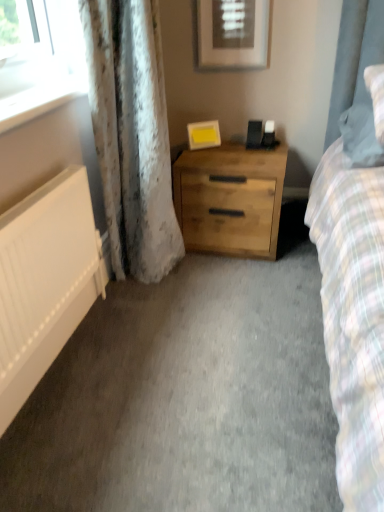
The image size is (384, 512). What do you see at coordinates (230, 199) in the screenshot?
I see `natural wood chest of drawers at center` at bounding box center [230, 199].

At what (x,y) coordinates should I click in order to perform the action: click on white matte radiator at left. Please return your answer as a coordinate pair (x, y). The width and height of the screenshot is (384, 512). Looking at the image, I should click on (45, 281).

At what (x,y) coordinates should I click in order to perform the action: click on fluffy white pillow at right. Please return your answer as a coordinate pair (x, y). This screenshot has width=384, height=512. Looking at the image, I should click on (366, 123).

How much space does matte white picture frame at upper center, the 2th picture frame positioned from the bottom, occupy horizontally?

matte white picture frame at upper center, the 2th picture frame positioned from the bottom, is 1.44 inches in width.

Find the location of a particular element. Image resolution: width=384 pixels, height=512 pixels. yellow matte picture frame at center, which is counted as the 2th picture frame, starting from the top is located at coordinates (203, 134).

At what (x,y) coordinates should I click in order to perform the action: click on white textured curtain at left. Please return your answer as a coordinate pair (x, y). Looking at the image, I should click on click(132, 135).

The width and height of the screenshot is (384, 512). In order to click on natural wood chest of drawers at center in this screenshot , I will do `click(230, 199)`.

Which object is more forward, fluffy white pillow at right or matte white picture frame at upper center, which appears as the 1th picture frame when viewed from the top?

fluffy white pillow at right is in front.

Starting from the fluffy white pillow at right, which picture frame is the 1st one to the left? Please provide its 2D coordinates.

[(233, 34)]

Where is `chest of drawers that appears on the right of matte white picture frame at upper center, the 2th picture frame positioned from the bottom`? chest of drawers that appears on the right of matte white picture frame at upper center, the 2th picture frame positioned from the bottom is located at coordinates (230, 199).

Does point (240, 168) come in front of point (248, 46)?

Yes, point (240, 168) is closer to viewer.

Is natural wood chest of drawers at center bigger or smaller than matte white picture frame at upper center, the 2th picture frame positioned from the bottom?

Considering their sizes, natural wood chest of drawers at center takes up more space than matte white picture frame at upper center, the 2th picture frame positioned from the bottom.

From the image's perspective, which one is positioned higher, natural wood chest of drawers at center or matte white picture frame at upper center, which appears as the 1th picture frame when viewed from the top?

From the image's view, matte white picture frame at upper center, which appears as the 1th picture frame when viewed from the top, is above.

From the image's perspective, which one is positioned higher, white matte radiator at left or white glossy window sill at upper left?

white glossy window sill at upper left, from the image's perspective.

From the picture: From a real-world perspective, which object rests below the other?

white matte radiator at left is physically lower.

Is white matte radiator at left oriented away from white glossy window sill at upper left?

No, white glossy window sill at upper left is not at the back of white matte radiator at left.

Between yellow matte picture frame at center, which is counted as the 2th picture frame, starting from the top, and matte white picture frame at upper center, the 2th picture frame positioned from the bottom, which one has larger size?

With larger size is matte white picture frame at upper center, the 2th picture frame positioned from the bottom.

From the image's perspective, between yellow matte picture frame at center, which is counted as the 2th picture frame, starting from the top, and matte white picture frame at upper center, the 2th picture frame positioned from the bottom, who is located below?

yellow matte picture frame at center, which is counted as the 2th picture frame, starting from the top, appears lower in the image.

In the image, is yellow matte picture frame at center, which is the 1th picture frame in bottom-to-top order, on the left side or the right side of matte white picture frame at upper center, the 2th picture frame positioned from the bottom?

Clearly, yellow matte picture frame at center, which is the 1th picture frame in bottom-to-top order, is on the left of matte white picture frame at upper center, the 2th picture frame positioned from the bottom, in the image.

Does yellow matte picture frame at center, which is the 1th picture frame in bottom-to-top order, have a lesser height compared to matte white picture frame at upper center, which appears as the 1th picture frame when viewed from the top?

Yes.

Is white textured curtain at left next to yellow matte picture frame at center, which is the 1th picture frame in bottom-to-top order, and touching it?

No, white textured curtain at left is not next to yellow matte picture frame at center, which is the 1th picture frame in bottom-to-top order.

Is white textured curtain at left outside of yellow matte picture frame at center, which is counted as the 2th picture frame, starting from the top?

white textured curtain at left lies outside yellow matte picture frame at center, which is counted as the 2th picture frame, starting from the top,'s area.

Which is behind, white textured curtain at left or yellow matte picture frame at center, which is the 1th picture frame in bottom-to-top order?

yellow matte picture frame at center, which is the 1th picture frame in bottom-to-top order, is further away from the camera.

Locate an element on the screen. The image size is (384, 512). the chest of drawers that appears below the fluffy white pillow at right (from the image's perspective) is located at coordinates (230, 199).

Consider the image. Does fluffy white pillow at right touch natural wood chest of drawers at center?

No, fluffy white pillow at right is not next to natural wood chest of drawers at center.

Considering the positions of objects matte white picture frame at upper center, which appears as the 1th picture frame when viewed from the top, and yellow matte picture frame at center, which is counted as the 2th picture frame, starting from the top, in the image provided, who is more to the left, matte white picture frame at upper center, which appears as the 1th picture frame when viewed from the top, or yellow matte picture frame at center, which is counted as the 2th picture frame, starting from the top,?

yellow matte picture frame at center, which is counted as the 2th picture frame, starting from the top.

The image size is (384, 512). Find the location of `picture frame above the yellow matte picture frame at center, which is counted as the 2th picture frame, starting from the top (from a real-world perspective)`. picture frame above the yellow matte picture frame at center, which is counted as the 2th picture frame, starting from the top (from a real-world perspective) is located at coordinates (233, 34).

Does matte white picture frame at upper center, which appears as the 1th picture frame when viewed from the top, turn towards yellow matte picture frame at center, which is counted as the 2th picture frame, starting from the top?

No, matte white picture frame at upper center, which appears as the 1th picture frame when viewed from the top, is not facing towards yellow matte picture frame at center, which is counted as the 2th picture frame, starting from the top.

Is matte white picture frame at upper center, which appears as the 1th picture frame when viewed from the top, smaller than yellow matte picture frame at center, which is the 1th picture frame in bottom-to-top order?

No, matte white picture frame at upper center, which appears as the 1th picture frame when viewed from the top, is not smaller than yellow matte picture frame at center, which is the 1th picture frame in bottom-to-top order.

Where is `pillow below the matte white picture frame at upper center, which appears as the 1th picture frame when viewed from the top (from the image's perspective)`? This screenshot has width=384, height=512. pillow below the matte white picture frame at upper center, which appears as the 1th picture frame when viewed from the top (from the image's perspective) is located at coordinates (366, 123).

Starting from the natural wood chest of drawers at center, which picture frame is the 1st one to the left? Please provide its 2D coordinates.

[(233, 34)]

Looking at the image, which one is located closer to yellow matte picture frame at center, which is counted as the 2th picture frame, starting from the top, white matte radiator at left or fluffy white pillow at right?

fluffy white pillow at right.

Estimate the real-world distances between objects in this image. Which object is closer to fluffy white pillow at right, matte white picture frame at upper center, the 2th picture frame positioned from the bottom, or white textured curtain at left?

matte white picture frame at upper center, the 2th picture frame positioned from the bottom, lies closer to fluffy white pillow at right than the other object.

Considering their positions, is white glossy window sill at upper left positioned further to fluffy white pillow at right than natural wood chest of drawers at center?

white glossy window sill at upper left.

When comparing their distances from natural wood chest of drawers at center, does fluffy white pillow at right or white textured curtain at left seem further?

The object further to natural wood chest of drawers at center is fluffy white pillow at right.

Based on the photo, which object lies nearer to the anchor point fluffy white pillow at right, white matte radiator at left or white glossy window sill at upper left?

white glossy window sill at upper left is closer to fluffy white pillow at right.

Estimate the real-world distances between objects in this image. Which object is closer to white textured curtain at left, white glossy window sill at upper left or fluffy white pillow at right?

white glossy window sill at upper left is positioned closer to the anchor white textured curtain at left.

Considering their positions, is natural wood chest of drawers at center positioned closer to white glossy window sill at upper left than yellow matte picture frame at center, which is counted as the 2th picture frame, starting from the top?

natural wood chest of drawers at center is closer to white glossy window sill at upper left.

In the scene shown: From the image, which object appears to be nearer to white textured curtain at left, fluffy white pillow at right or natural wood chest of drawers at center?

Among the two, natural wood chest of drawers at center is located nearer to white textured curtain at left.

At what (x,y) coordinates should I click in order to perform the action: click on pillow between matte white picture frame at upper center, which appears as the 1th picture frame when viewed from the top, and natural wood chest of drawers at center, in the vertical direction. Please return your answer as a coordinate pair (x, y). This screenshot has height=512, width=384. Looking at the image, I should click on (366, 123).

You are a GUI agent. You are given a task and a screenshot of the screen. Output one action in this format:
    pyautogui.click(x=<x>, y=<y>)
    Task: Click on the pillow between matte white picture frame at upper center, the 2th picture frame positioned from the bottom, and white matte radiator at left, in the vertical direction
    The height and width of the screenshot is (512, 384).
    Given the screenshot: What is the action you would take?
    pyautogui.click(x=366, y=123)

You are a GUI agent. You are given a task and a screenshot of the screen. Output one action in this format:
    pyautogui.click(x=<x>, y=<y>)
    Task: Click on the chest of drawers between white matte radiator at left and fluffy white pillow at right from left to right
    
    Given the screenshot: What is the action you would take?
    pyautogui.click(x=230, y=199)

The width and height of the screenshot is (384, 512). In order to click on curtain between matte white picture frame at upper center, which appears as the 1th picture frame when viewed from the top, and natural wood chest of drawers at center, in the vertical direction in this screenshot , I will do pyautogui.click(x=132, y=135).